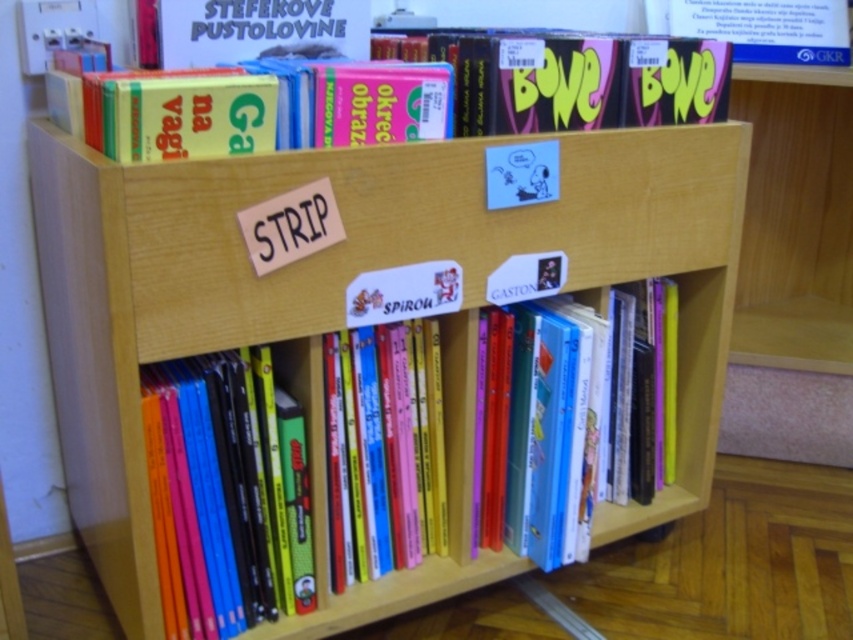
Which is more to the left, hardcover book at center or matte yellow book at upper center?

hardcover book at center is more to the left.

Looking at this image, does hardcover book at center appear on the left side of matte yellow book at upper center?

Yes, hardcover book at center is to the left of matte yellow book at upper center.

The width and height of the screenshot is (853, 640). What do you see at coordinates (550, 424) in the screenshot?
I see `hardcover book at center` at bounding box center [550, 424].

Identify the location of hardcover book at center. This screenshot has width=853, height=640. (550, 424).

Who is positioned more to the left, matte plastic book at upper center or matte yellow book at upper center?

Positioned to the left is matte plastic book at upper center.

Does point (676, 51) come closer to viewer compared to point (814, 17)?

Yes.

Locate an element on the screen. This screenshot has width=853, height=640. matte plastic book at upper center is located at coordinates (585, 81).

Between wooden bookshelf at center and matte yellow book at upper center, which one appears on the right side from the viewer's perspective?

Positioned to the right is matte yellow book at upper center.

Can you confirm if wooden bookshelf at center is positioned to the right of matte yellow book at upper center?

In fact, wooden bookshelf at center is to the left of matte yellow book at upper center.

Which is behind, point (450, 221) or point (810, 35)?

The point (810, 35) is more distant.

Locate an element on the screen. wooden bookshelf at center is located at coordinates (344, 310).